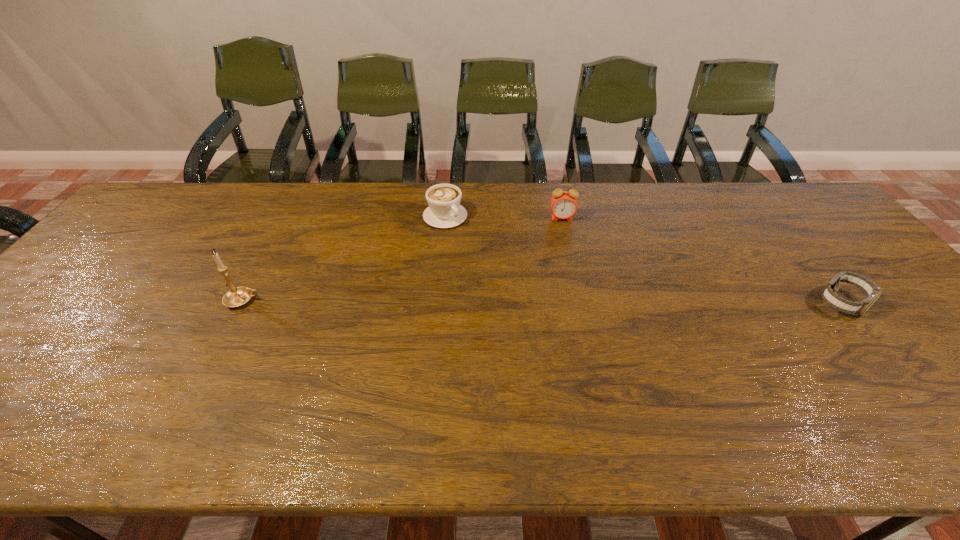
Image resolution: width=960 pixels, height=540 pixels. Identify the location of candle holder. (237, 296).

You are a GUI agent. You are given a task and a screenshot of the screen. Output one action in this format:
    pyautogui.click(x=<x>, y=<y>)
    Task: Click on the tallest object
    
    Given the screenshot: What is the action you would take?
    pyautogui.click(x=237, y=296)

Identify the location of the rightmost object. (871, 290).

In order to click on the third shortest object in this screenshot , I will do `click(564, 205)`.

Identify the location of the second object from right to left. The image size is (960, 540). (564, 205).

Identify the location of cappuccino. The image size is (960, 540). (444, 211).

Identify the location of vacant space located 0.130m on the handle side of the tallest object. This screenshot has width=960, height=540. (311, 300).

Where is `vacant space located 0.200m on the face of the third shortest object`? The width and height of the screenshot is (960, 540). vacant space located 0.200m on the face of the third shortest object is located at coordinates (566, 265).

Image resolution: width=960 pixels, height=540 pixels. I want to click on vacant space located 0.270m on the face of the third shortest object, so click(x=568, y=283).

At what (x,y) coordinates should I click in order to perform the action: click on vacant point located 0.180m on the face of the third shortest object. Please return your answer as a coordinate pair (x, y). The width and height of the screenshot is (960, 540). Looking at the image, I should click on (565, 261).